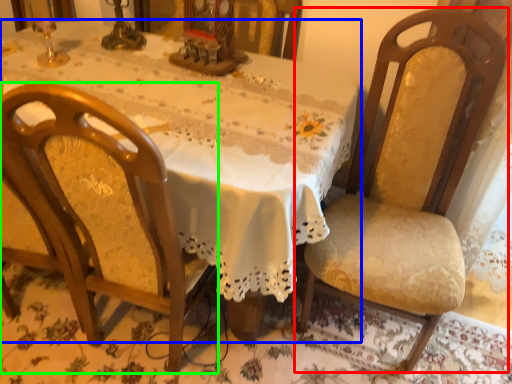
Question: Which object is positioned closest to chair (highlighted by a red box)? Select from table (highlighted by a blue box) and chair (highlighted by a green box).

Choices:
 (A) table
 (B) chair

Answer: (A)